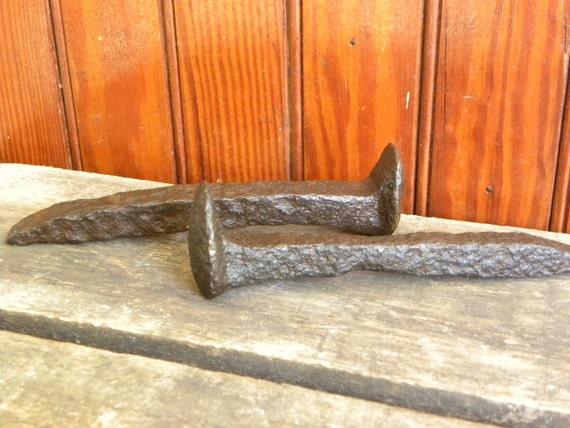
Locate an element on the screen. rough wooden boards is located at coordinates (116, 272), (50, 395).